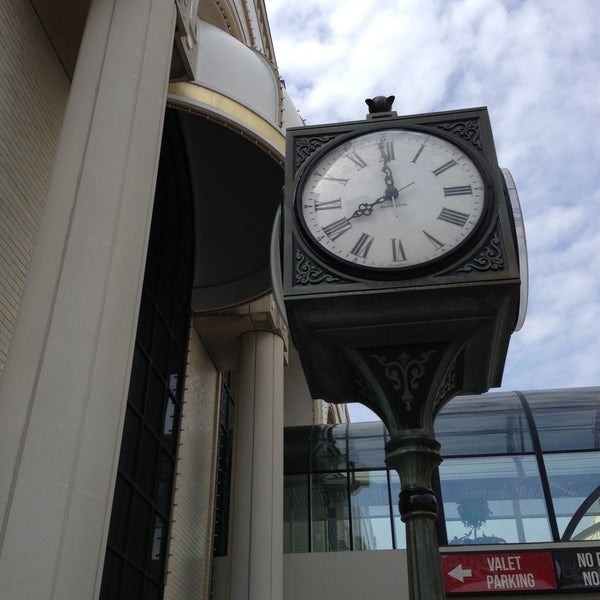
Locate an element on the screen. The width and height of the screenshot is (600, 600). pillar is located at coordinates (73, 434).